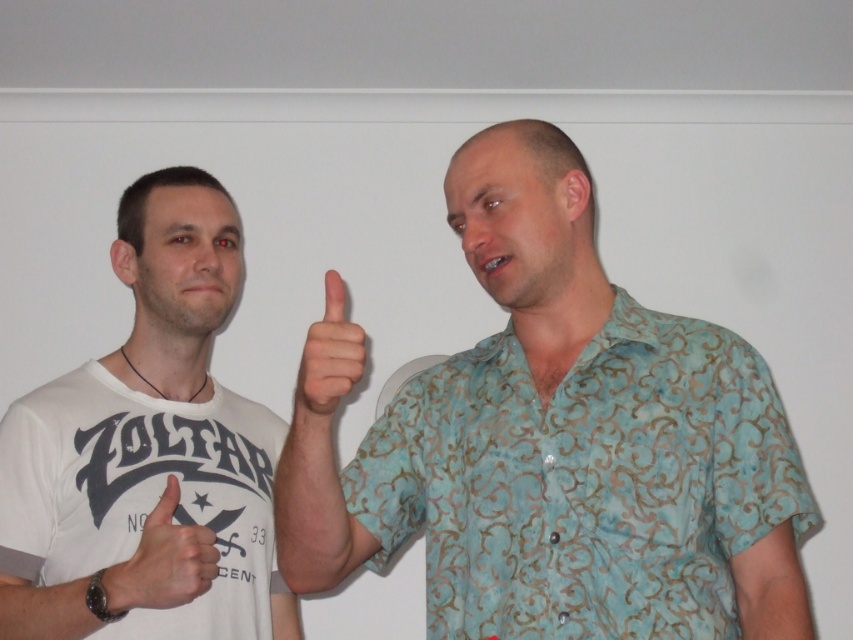
Is point (155, 515) positioned before point (335, 376)?

No, it is behind (335, 376).

Who is taller, white matte hand at center or matte skin at center?

white matte hand at center

Which is behind, point (167, 568) or point (320, 416)?

Positioned behind is point (167, 568).

This screenshot has width=853, height=640. I want to click on white matte hand at center, so click(163, 561).

Does blue patterned shirt at center have a smaller size compared to matte skin at center?

Actually, blue patterned shirt at center might be larger than matte skin at center.

Where is `blue patterned shirt at center`? blue patterned shirt at center is located at coordinates (560, 444).

Find the location of a particular element. This screenshot has height=640, width=853. blue patterned shirt at center is located at coordinates (560, 444).

Is blue patterned shirt at center above white matte hand at center?

Yes, blue patterned shirt at center is above white matte hand at center.

Between blue patterned shirt at center and white matte hand at center, which one appears on the right side from the viewer's perspective?

blue patterned shirt at center is more to the right.

Is point (643, 369) less distant than point (202, 532)?

Yes, point (643, 369) is in front of point (202, 532).

The image size is (853, 640). What are the coordinates of `blue patterned shirt at center` in the screenshot? It's located at (560, 444).